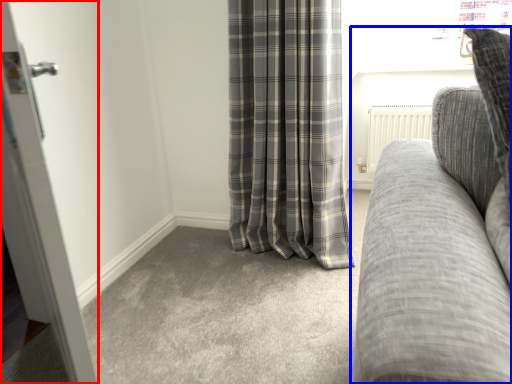
Question: Among these objects, which one is nearest to the camera, door (highlighted by a red box) or studio couch (highlighted by a blue box)?

Choices:
 (A) door
 (B) studio couch

Answer: (B)